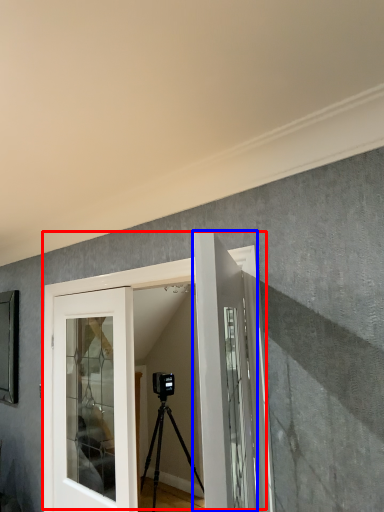
Question: Which object is further to the camera taking this photo, door (highlighted by a red box) or door (highlighted by a blue box)?

Choices:
 (A) door
 (B) door

Answer: (A)